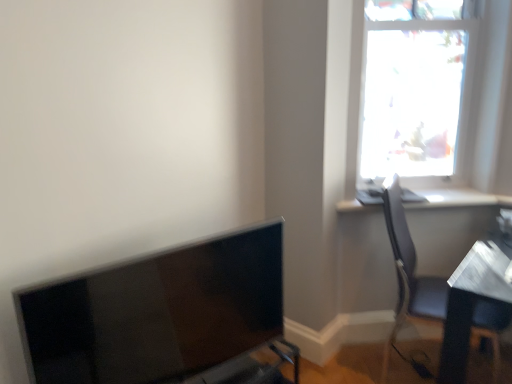
Question: Should I look upward or downward to see white glossy window sill at upper right?

Choices:
 (A) up
 (B) down

Answer: (B)

Question: Is transparent glass window at upper right wider than matte gray chair at right?

Choices:
 (A) no
 (B) yes

Answer: (A)

Question: From the image's perspective, does transparent glass window at upper right appear higher than matte gray chair at right?

Choices:
 (A) yes
 (B) no

Answer: (A)

Question: Does transparent glass window at upper right have a greater height compared to matte gray chair at right?

Choices:
 (A) no
 (B) yes

Answer: (A)

Question: Does transparent glass window at upper right have a lesser height compared to matte gray chair at right?

Choices:
 (A) no
 (B) yes

Answer: (B)

Question: Is transparent glass window at upper right in contact with matte gray chair at right?

Choices:
 (A) no
 (B) yes

Answer: (A)

Question: Considering the relative sizes of transparent glass window at upper right and matte gray chair at right in the image provided, is transparent glass window at upper right bigger than matte gray chair at right?

Choices:
 (A) yes
 (B) no

Answer: (B)

Question: Is matte gray chair at right at the left side of transparent glass window at upper right?

Choices:
 (A) no
 (B) yes

Answer: (A)

Question: Considering the relative sizes of matte gray chair at right and transparent glass window at upper right in the image provided, is matte gray chair at right thinner than transparent glass window at upper right?

Choices:
 (A) no
 (B) yes

Answer: (A)

Question: Would you say matte gray chair at right is outside transparent glass window at upper right?

Choices:
 (A) no
 (B) yes

Answer: (B)

Question: Can you confirm if matte gray chair at right is smaller than transparent glass window at upper right?

Choices:
 (A) yes
 (B) no

Answer: (B)

Question: Is matte gray chair at right shorter than transparent glass window at upper right?

Choices:
 (A) yes
 (B) no

Answer: (B)

Question: Does matte gray chair at right have a greater width compared to transparent glass window at upper right?

Choices:
 (A) yes
 (B) no

Answer: (A)

Question: Does transparent glass window at upper right lie behind matte black monitor at lower left?

Choices:
 (A) no
 (B) yes

Answer: (B)